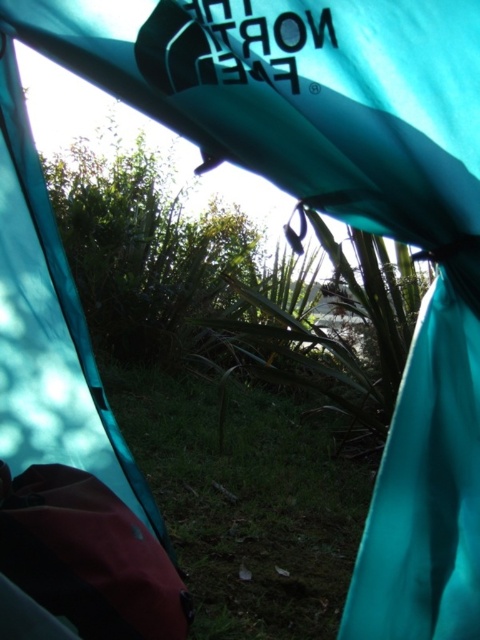
In the scene shown: You are setting up a tent and want to place both the green grass at center and the maroon synthetic sleeping bag at lower left. According to the scene, which object is located to the right of the other?

The green grass at center is positioned on the right side of the maroon synthetic sleeping bag at lower left, so the green grass at center is to the right of the maroon synthetic sleeping bag at lower left.

You are setting up a campsite and need to decide where to place your tent. Based on the scene, which object takes up more space, the teal fabric tent at upper left or the green grass at center?

The green grass at center takes up more space than the teal fabric tent at upper left.